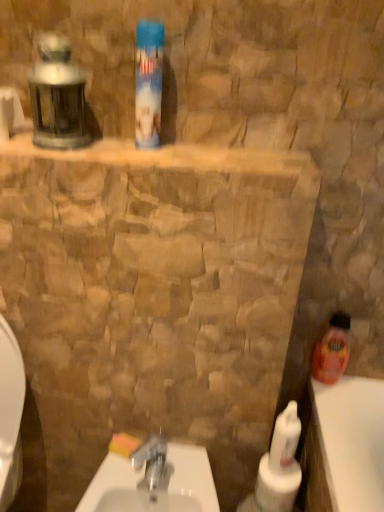
Question: Is white glossy sink at center oriented away from white glossy bottle at lower right, the second cleaning product positioned from the left?

Choices:
 (A) yes
 (B) no

Answer: (B)

Question: Is white glossy sink at center oriented towards white glossy bottle at lower right, acting as the 2th cleaning product starting from the right?

Choices:
 (A) yes
 (B) no

Answer: (B)

Question: Is white glossy sink at center at the left side of white glossy bottle at lower right, the second cleaning product in the front-to-back sequence?

Choices:
 (A) no
 (B) yes

Answer: (B)

Question: Would you say white glossy bottle at lower right, the third cleaning product in the top-to-bottom sequence, is part of white glossy sink at center's contents?

Choices:
 (A) yes
 (B) no

Answer: (B)

Question: From the image's perspective, is white glossy sink at center over white glossy bottle at lower right, acting as the 2th cleaning product starting from the right?

Choices:
 (A) no
 (B) yes

Answer: (A)

Question: In the image, is white glossy sink at center on the left side or the right side of white glossy bottle at lower right, the third cleaning product in the top-to-bottom sequence?

Choices:
 (A) left
 (B) right

Answer: (A)

Question: Looking at the image, does white glossy sink at center seem bigger or smaller compared to white glossy bottle at lower right, acting as the 2th cleaning product starting from the right?

Choices:
 (A) big
 (B) small

Answer: (A)

Question: From a real-world perspective, is white glossy sink at center positioned above or below white glossy bottle at lower right, which is the 1th cleaning product in bottom-to-top order?

Choices:
 (A) above
 (B) below

Answer: (B)

Question: Considering the positions of point (84, 508) and point (279, 453), is point (84, 508) closer or farther from the camera than point (279, 453)?

Choices:
 (A) farther
 (B) closer

Answer: (B)

Question: From the image's perspective, is blue plastic can at upper center, arranged as the 3th cleaning product when viewed from the back, located above or below translucent plastic bottle at right, the 2th cleaning product positioned from the top?

Choices:
 (A) above
 (B) below

Answer: (A)

Question: Would you say blue plastic can at upper center, the first cleaning product from the left, is inside or outside translucent plastic bottle at right, the 1th cleaning product in the back-to-front sequence?

Choices:
 (A) outside
 (B) inside

Answer: (A)

Question: Visually, is blue plastic can at upper center, the 1th cleaning product from the top, positioned to the left or to the right of translucent plastic bottle at right, the 1th cleaning product in the back-to-front sequence?

Choices:
 (A) right
 (B) left

Answer: (B)

Question: In the image, is blue plastic can at upper center, the 1th cleaning product from the top, positioned in front of or behind translucent plastic bottle at right, the first cleaning product in the right-to-left sequence?

Choices:
 (A) behind
 (B) front

Answer: (B)

Question: From a real-world perspective, relative to blue plastic can at upper center, the first cleaning product from the left, is white glossy sink at center vertically above or below?

Choices:
 (A) below
 (B) above

Answer: (A)

Question: Considering their positions, is white glossy sink at center located in front of or behind blue plastic can at upper center, arranged as the 3th cleaning product when viewed from the back?

Choices:
 (A) front
 (B) behind

Answer: (B)